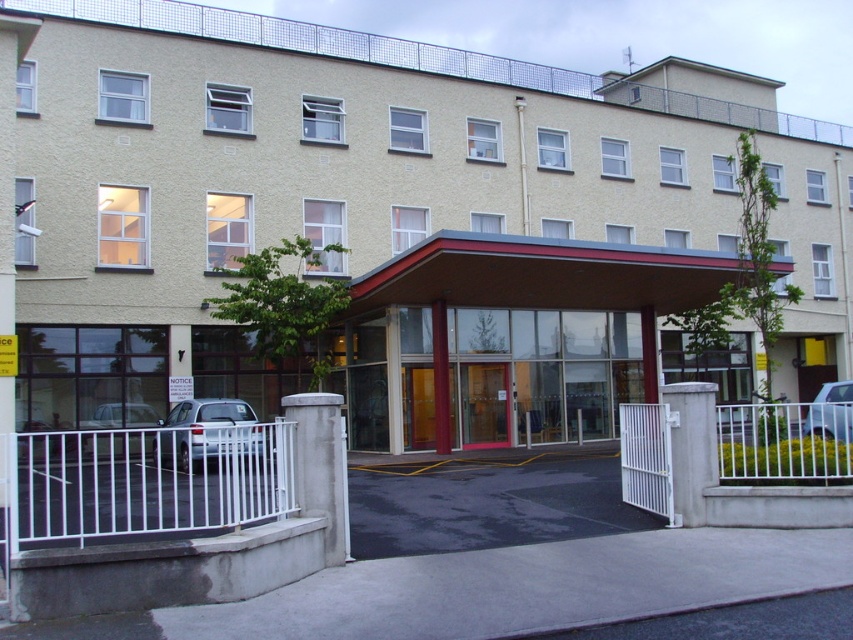
Is matte glass entrance at center to the left of white metallic car at center from the viewer's perspective?

Indeed, matte glass entrance at center is positioned on the left side of white metallic car at center.

Where is `matte glass entrance at center`? The height and width of the screenshot is (640, 853). matte glass entrance at center is located at coordinates (360, 177).

Is point (369, 195) in front of point (846, 429)?

That is False.

At what (x,y) coordinates should I click in order to perform the action: click on matte glass entrance at center. Please return your answer as a coordinate pair (x, y). Looking at the image, I should click on (360, 177).

Locate an element on the screen. satin silver car at lower left is located at coordinates (210, 433).

Describe the element at coordinates (210, 433) in the screenshot. This screenshot has width=853, height=640. I see `satin silver car at lower left` at that location.

Locate an element on the screen. The image size is (853, 640). satin silver car at lower left is located at coordinates (210, 433).

Between satin silver car at lower left and wooden door at center, which one appears on the right side from the viewer's perspective?

From the viewer's perspective, wooden door at center appears more on the right side.

Which is behind, point (170, 429) or point (495, 433)?

Positioned behind is point (495, 433).

Locate an element on the screen. This screenshot has width=853, height=640. satin silver car at lower left is located at coordinates (210, 433).

Where is `satin silver car at lower left`? The image size is (853, 640). satin silver car at lower left is located at coordinates (210, 433).